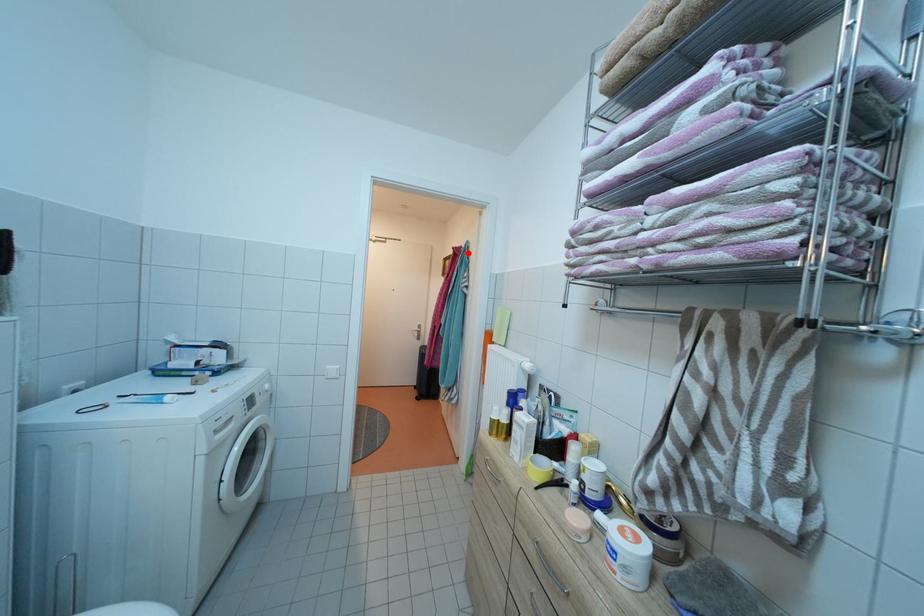
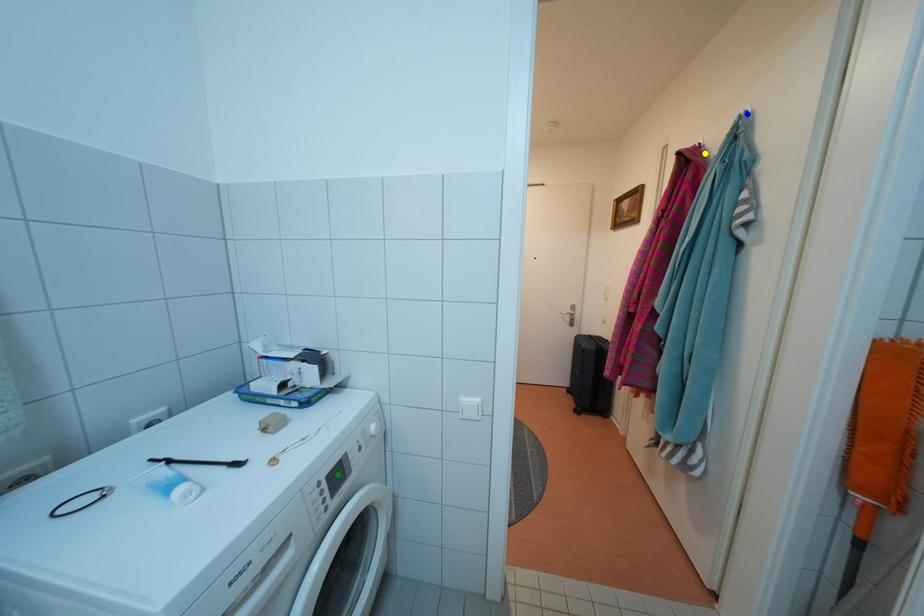
Question: I am providing you with two images of the same scene from different viewpoints. A red point is marked on the first image. You are given multiple points on the second image. Which point in image 2 represents the same 3d spot as the red point in image 1?

Choices:
 (A) blue point
 (B) yellow point
 (C) green point

Answer: (B)